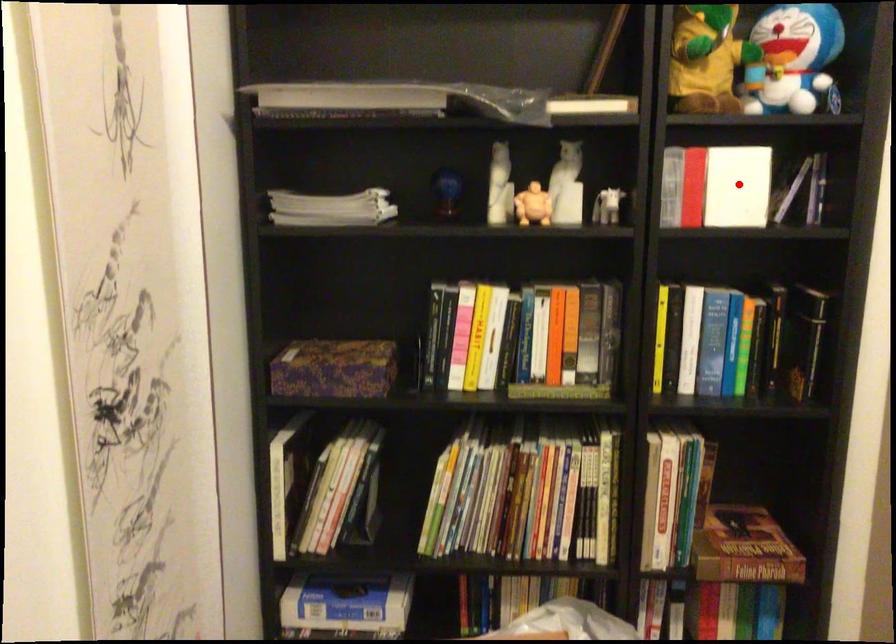
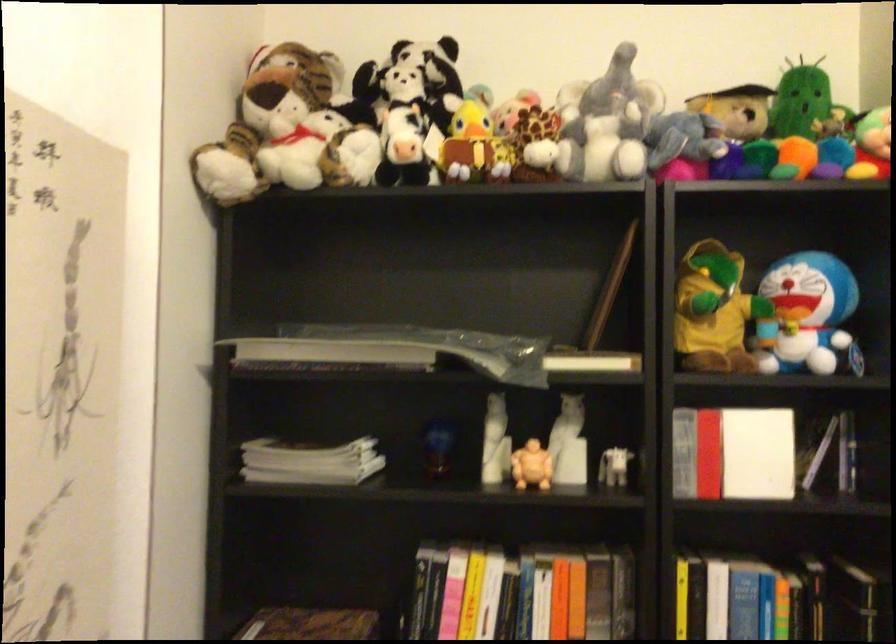
Question: I am providing you with two images of the same scene from different viewpoints. Given a red point in image1, look at the same physical point in image2. Is it:

Choices:
 (A) Closer to the viewpoint
 (B) Farther from the viewpoint

Answer: (A)